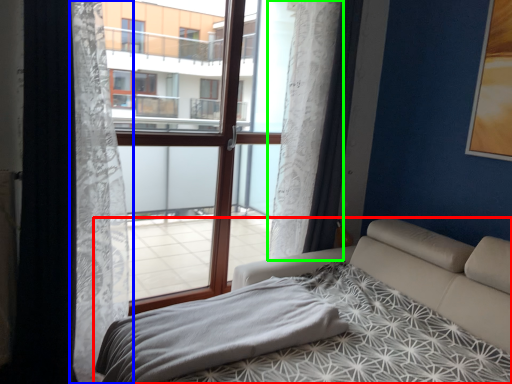
Question: Which object is the farthest from bed (highlighted by a red box)? Choose among these: curtain (highlighted by a blue box) or curtain (highlighted by a green box).

Choices:
 (A) curtain
 (B) curtain

Answer: (A)